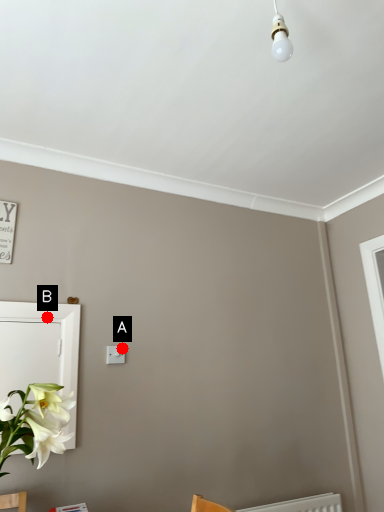
Question: Two points are circled on the image, labeled by A and B beside each circle. Among these points, which one is nearest to the camera?

Choices:
 (A) A is closer
 (B) B is closer

Answer: (B)